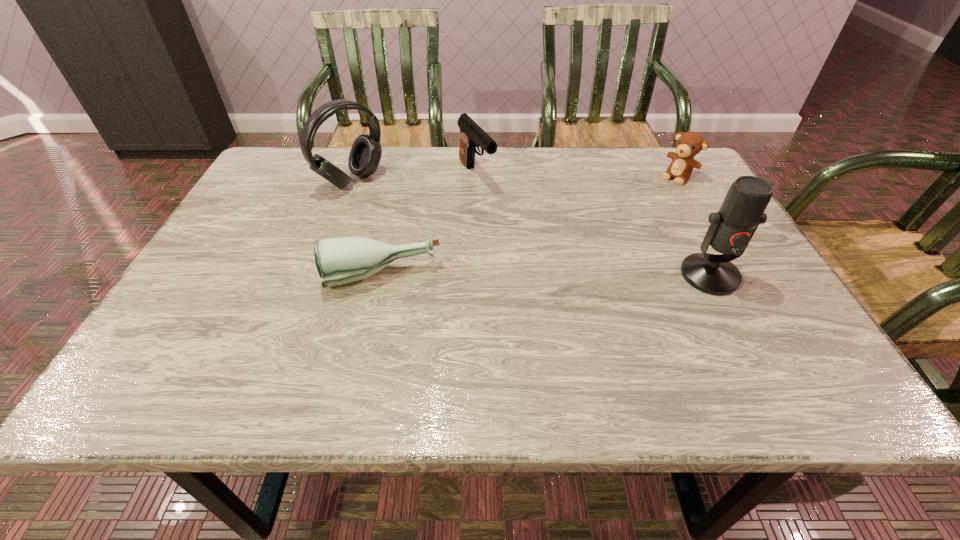
Identify the location of vacant region between the third shortest object and the teddy bear. This screenshot has height=540, width=960. (577, 176).

The image size is (960, 540). Find the location of `free space between the third object from left to right and the fourth tallest object`. free space between the third object from left to right and the fourth tallest object is located at coordinates (577, 176).

This screenshot has width=960, height=540. I want to click on free space between the teddy bear and the microphone, so click(693, 226).

Locate an element on the screen. unoccupied position between the bottle and the headset is located at coordinates tap(367, 228).

At what (x,y) coordinates should I click in order to perform the action: click on free spot between the microphone and the headset. Please return your answer as a coordinate pair (x, y). Looking at the image, I should click on (531, 228).

Identify the location of free space between the second shortest object and the third object from right to left. (577, 176).

Locate an element on the screen. The width and height of the screenshot is (960, 540). unoccupied area between the headset and the microphone is located at coordinates (531, 228).

Identify which object is the nearest to the microphone. Please provide its 2D coordinates. Your answer should be formatted as a tuple, i.e. [(x, y)], where the tuple contains the x and y coordinates of a point satisfying the conditions above.

[(689, 144)]

The width and height of the screenshot is (960, 540). Identify the location of the second closest object to the headset. (342, 260).

Locate an element on the screen. The height and width of the screenshot is (540, 960). vacant space that satisfies the following two spatial constraints: 1. on the back side of the headset; 2. on the right side of the third object from left to right is located at coordinates (354, 174).